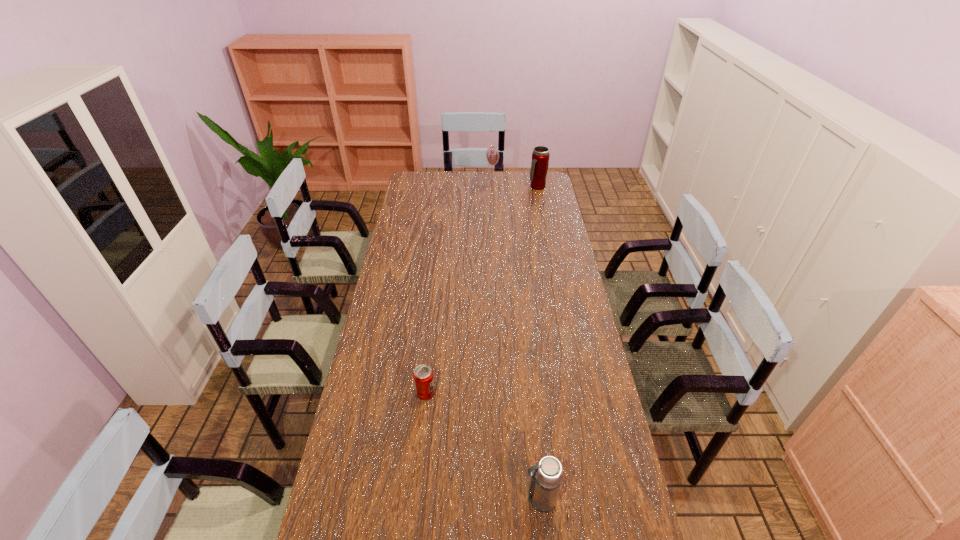
Locate an element on the screen. blank space at the far left corner of the desktop is located at coordinates tap(419, 176).

Locate an element on the screen. free space that is in between the soda can and the farther thermos bottle is located at coordinates (482, 290).

You are a GUI agent. You are given a task and a screenshot of the screen. Output one action in this format:
    pyautogui.click(x=<x>, y=<y>)
    Task: Click on the empty location between the wineglass and the left thermos bottle
    This screenshot has width=960, height=540.
    Given the screenshot: What is the action you would take?
    pyautogui.click(x=516, y=340)

What are the coordinates of `free space between the wineglass and the left thermos bottle` in the screenshot? It's located at (516, 340).

The image size is (960, 540). What are the coordinates of `blank region between the shortest object and the wineglass` in the screenshot? It's located at (459, 287).

This screenshot has width=960, height=540. What are the coordinates of `free space between the taller thermos bottle and the second object from right to left` in the screenshot? It's located at (539, 343).

This screenshot has width=960, height=540. In order to click on free space between the third farthest object and the rightmost object in this screenshot , I will do `click(482, 290)`.

You are a GUI agent. You are given a task and a screenshot of the screen. Output one action in this format:
    pyautogui.click(x=<x>, y=<y>)
    Task: Click on the free space between the leftmost object and the taller thermos bottle
    
    Given the screenshot: What is the action you would take?
    pyautogui.click(x=482, y=290)

Find the location of a particular element. free point between the rightmost object and the nearer thermos bottle is located at coordinates (539, 343).

Where is `blank region between the taller thermos bottle and the wineglass`? This screenshot has height=540, width=960. blank region between the taller thermos bottle and the wineglass is located at coordinates (515, 184).